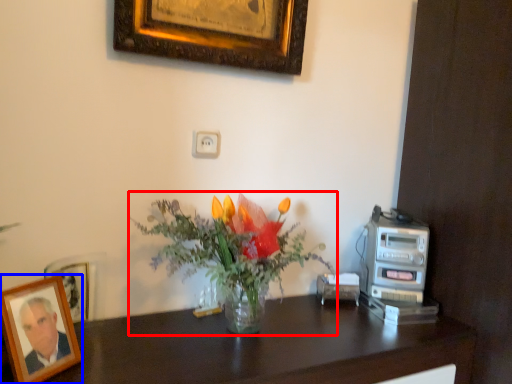
Question: Which object appears farthest to the camera in this image, flower (highlighted by a red box) or picture frame (highlighted by a blue box)?

Choices:
 (A) flower
 (B) picture frame

Answer: (A)